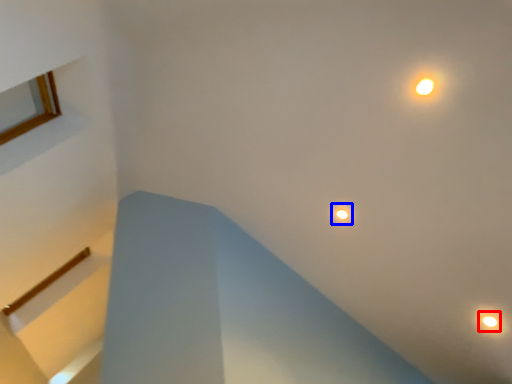
Question: Among these objects, which one is nearest to the camera, droplight (highlighted by a red box) or droplight (highlighted by a blue box)?

Choices:
 (A) droplight
 (B) droplight

Answer: (A)